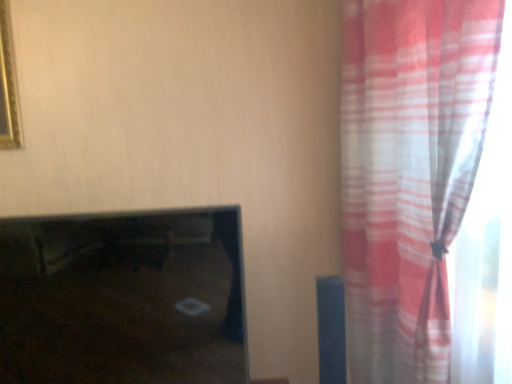
Identify the location of translucent striped curtain at right. This screenshot has width=512, height=384. (409, 173).

In order to face translucent striped curtain at right, should I rotate leftwards or rightwards?

Turn right approximately 19.884 degrees to face it.

This screenshot has width=512, height=384. What do you see at coordinates (409, 173) in the screenshot?
I see `translucent striped curtain at right` at bounding box center [409, 173].

Where is `translucent striped curtain at right`? The width and height of the screenshot is (512, 384). translucent striped curtain at right is located at coordinates (409, 173).